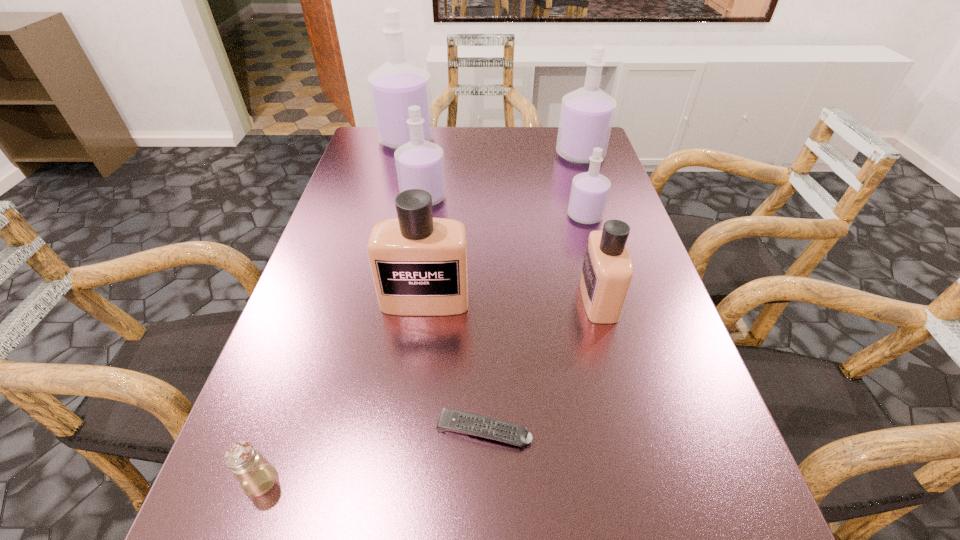
I want to click on the tallest object, so click(x=397, y=84).

Where is `the biggest purple perfume`? the biggest purple perfume is located at coordinates (397, 84).

Where is `the fifth shortest perfume`? The width and height of the screenshot is (960, 540). the fifth shortest perfume is located at coordinates (586, 117).

You are a GUI agent. You are given a task and a screenshot of the screen. Output one action in this format:
    pyautogui.click(x=<x>, y=<y>)
    Task: Click on the seventh shortest object
    This screenshot has width=960, height=540.
    Given the screenshot: What is the action you would take?
    pyautogui.click(x=586, y=117)

Identify the location of the third biggest purple perfume. The image size is (960, 540). coord(419,163).

At what (x,y) coordinates should I click in order to perform the action: click on the bigger beige perfume. Please return your answer as a coordinate pair (x, y). The height and width of the screenshot is (540, 960). Looking at the image, I should click on (419, 264).

Locate an element on the screen. Image resolution: width=960 pixels, height=540 pixels. the right beige perfume is located at coordinates (607, 270).

Where is `the smallest purple perfume`? the smallest purple perfume is located at coordinates (589, 193).

Where is `the seventh tallest object`? the seventh tallest object is located at coordinates (256, 475).

Where is `saltshaker`? The height and width of the screenshot is (540, 960). saltshaker is located at coordinates (256, 475).